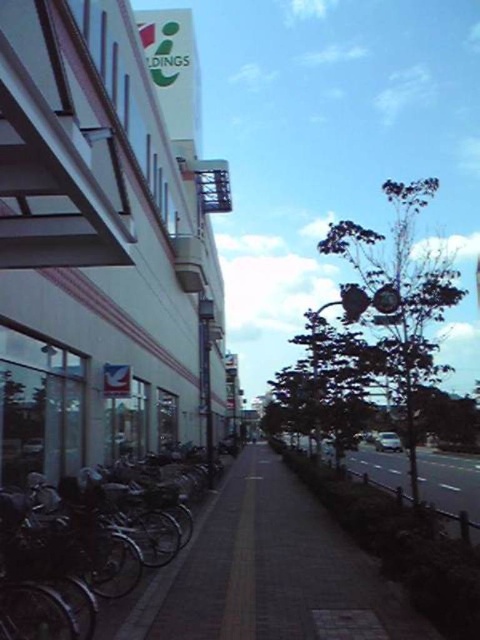
Question: Which is farther from the smooth asphalt road at center?

Choices:
 (A) silver metallic bicycle at left
 (B) brick paved sidewalk at center

Answer: (A)

Question: Is silver metallic bicycle at left to the left of smooth asphalt road at center from the viewer's perspective?

Choices:
 (A) no
 (B) yes

Answer: (B)

Question: Is brick paved sidewalk at center below silver metallic bicycle at left?

Choices:
 (A) no
 (B) yes

Answer: (B)

Question: Can you confirm if brick paved sidewalk at center is positioned to the left of smooth asphalt road at center?

Choices:
 (A) yes
 (B) no

Answer: (B)

Question: Which point is closer to the camera taking this photo?

Choices:
 (A) (239, 541)
 (B) (260, 449)

Answer: (A)

Question: Which point is closer to the camera?

Choices:
 (A) smooth asphalt road at center
 (B) silver metallic bicycle at left
 (C) brick paved sidewalk at center

Answer: (B)